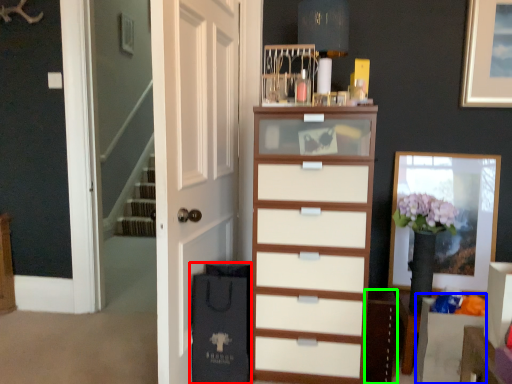
Question: Considering the real-world distances, which object is farthest from shopping bag (highlighted by a red box)? vanity (highlighted by a blue box) or cabinetry (highlighted by a green box)?

Choices:
 (A) vanity
 (B) cabinetry

Answer: (A)